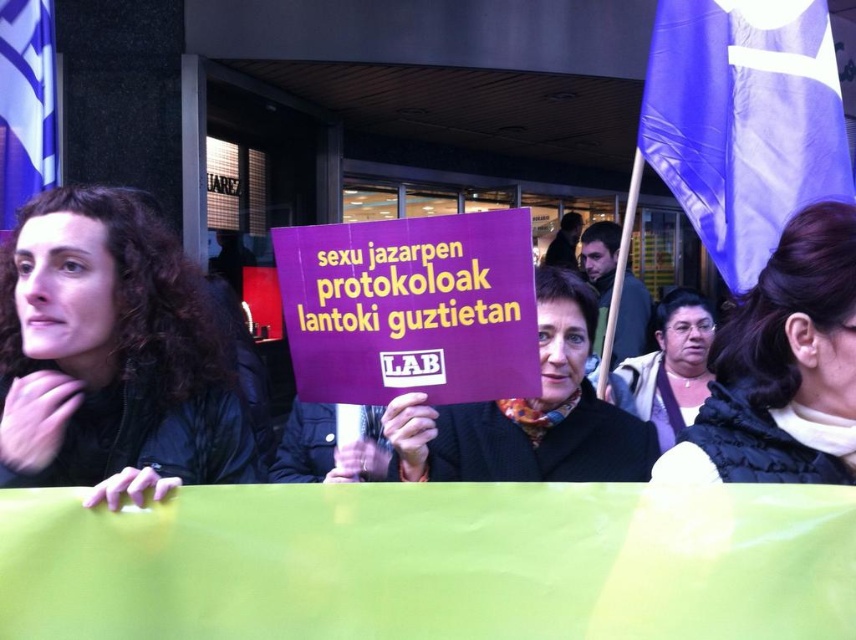
Consider the image. You are a photographer at the protest scene. You want to take a photo that includes both the dark curly hair at left and the purple matte sign at center. Which object should you focus on first to ensure both are in frame?

Since the dark curly hair at left is smaller in size compared to the purple matte sign at center, you should focus on the purple matte sign at center first to ensure both fit within the frame.

You are a photographer trying to capture the protest scene. You notice the dark curly hair at left and the purple matte sign at center. Which object would appear narrower in your photo?

The dark curly hair at left has a lesser width compared to the purple matte sign at center, so it would appear narrower in the photo.

You are a photographer at the protest scene. You want to capture a photo that includes both the purple fabric flag at upper right and the purple matte sign at center. Which object should you adjust your camera angle to focus on first to ensure both are in frame?

The purple fabric flag at upper right is taller than the purple matte sign at center, so you should first focus on the purple fabric flag at upper right to ensure the entire height of the flag is captured before adjusting the frame to include the sign.